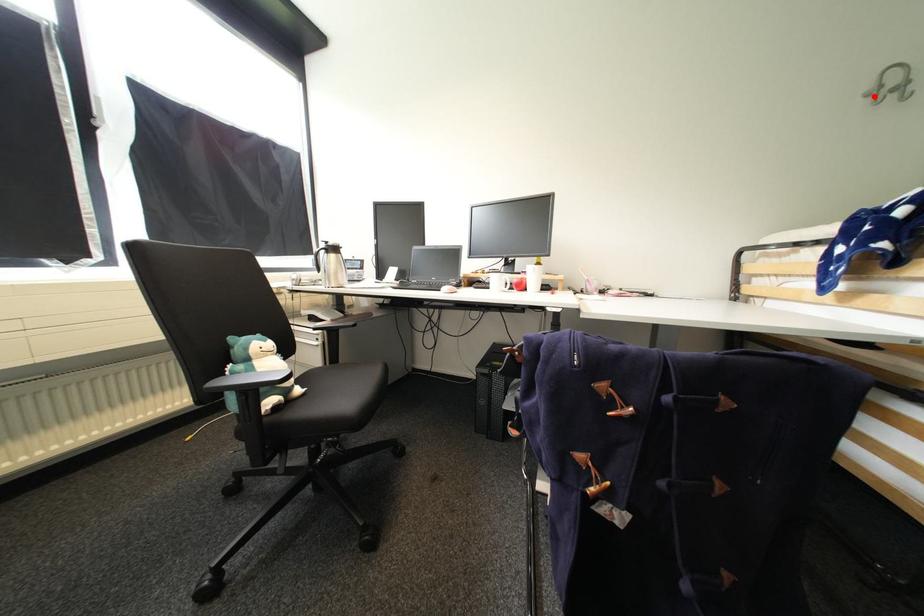
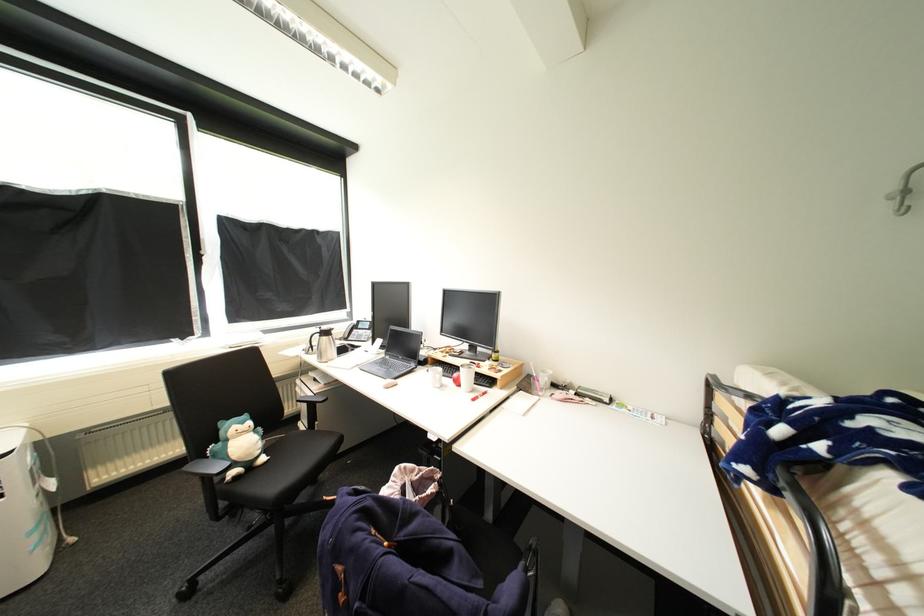
Find the pixel in the second image that matches the highlighted location in the first image.

(900, 199)